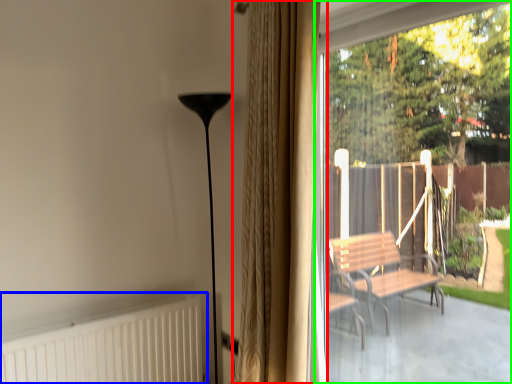
Question: Considering the real-world distances, which object is closest to curtain (highlighted by a red box)? radiator (highlighted by a blue box) or window screen (highlighted by a green box).

Choices:
 (A) radiator
 (B) window screen

Answer: (A)